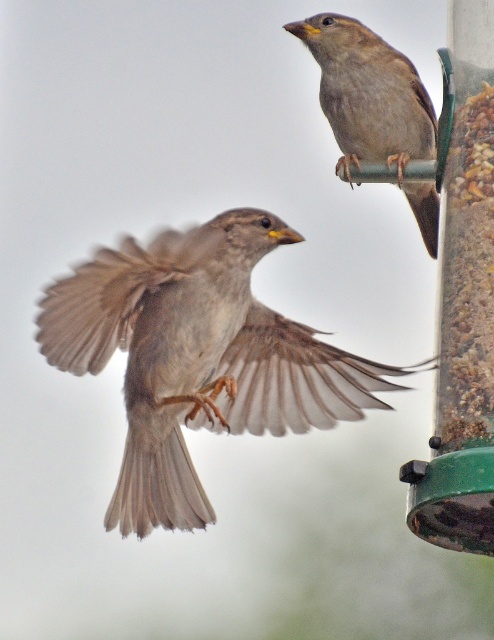
Is brown feathered sparrow at center above brown feathered sparrow at upper right?

No.

Between point (176, 241) and point (342, 83), which one is positioned behind?

The point (342, 83) is more distant.

Where is `brown feathered sparrow at center`? Image resolution: width=494 pixels, height=640 pixels. brown feathered sparrow at center is located at coordinates (198, 356).